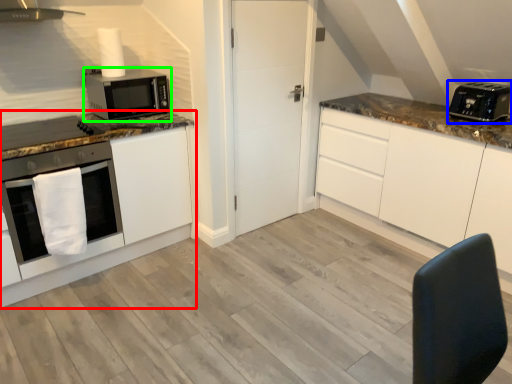
Question: Considering the real-world distances, which object is closest to cabinetry (highlighted by a red box)? toaster (highlighted by a blue box) or microwave oven (highlighted by a green box).

Choices:
 (A) toaster
 (B) microwave oven

Answer: (B)